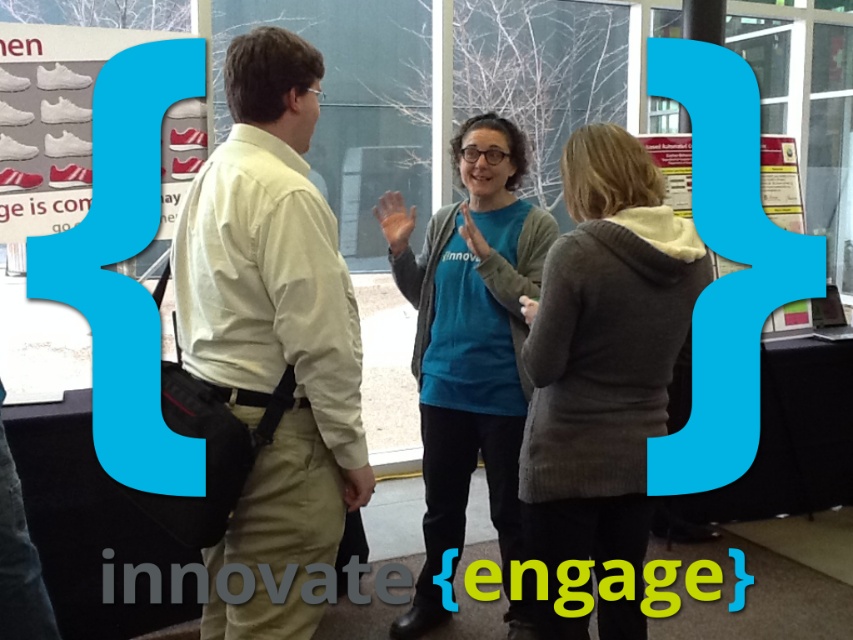
From the picture: Can you confirm if light beige shirt at center is positioned to the left of blue cotton shirt at center?

Indeed, light beige shirt at center is positioned on the left side of blue cotton shirt at center.

Is the position of light beige shirt at center less distant than that of blue cotton shirt at center?

Yes, it is.

This screenshot has height=640, width=853. In order to click on light beige shirt at center in this screenshot , I will do `click(271, 339)`.

Does light beige shirt at center have a greater width compared to gray knit sweater at center?

In fact, light beige shirt at center might be narrower than gray knit sweater at center.

Which of these two, light beige shirt at center or gray knit sweater at center, stands taller?

light beige shirt at center

Does point (250, 81) come in front of point (526, 456)?

Yes, point (250, 81) is in front of point (526, 456).

Locate an element on the screen. The width and height of the screenshot is (853, 640). light beige shirt at center is located at coordinates (271, 339).

Is point (584, 248) closer to camera compared to point (482, 225)?

That is True.

Does gray knit sweater at center appear over blue cotton shirt at center?

Yes.

Where is `gray knit sweater at center`? The height and width of the screenshot is (640, 853). gray knit sweater at center is located at coordinates (602, 369).